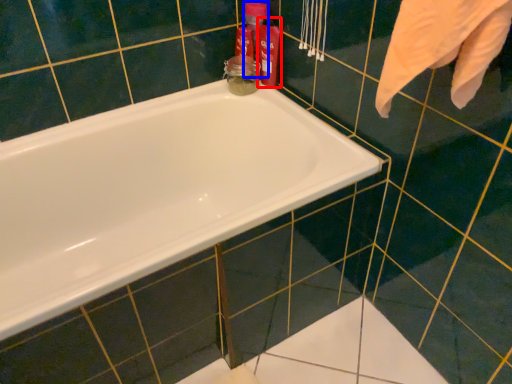
Question: Which point is closer to the camera, cleaning product (highlighted by a red box) or cleaning product (highlighted by a blue box)?

Choices:
 (A) cleaning product
 (B) cleaning product

Answer: (A)